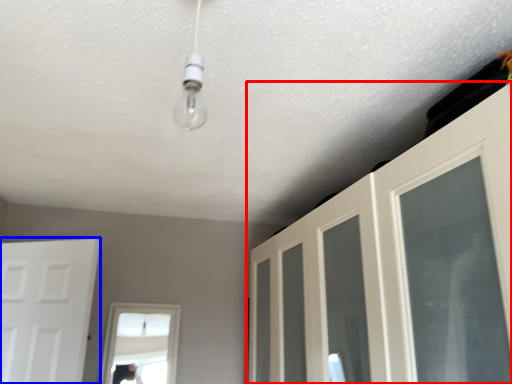
Question: Among these objects, which one is farthest to the camera, door (highlighted by a red box) or door (highlighted by a blue box)?

Choices:
 (A) door
 (B) door

Answer: (B)